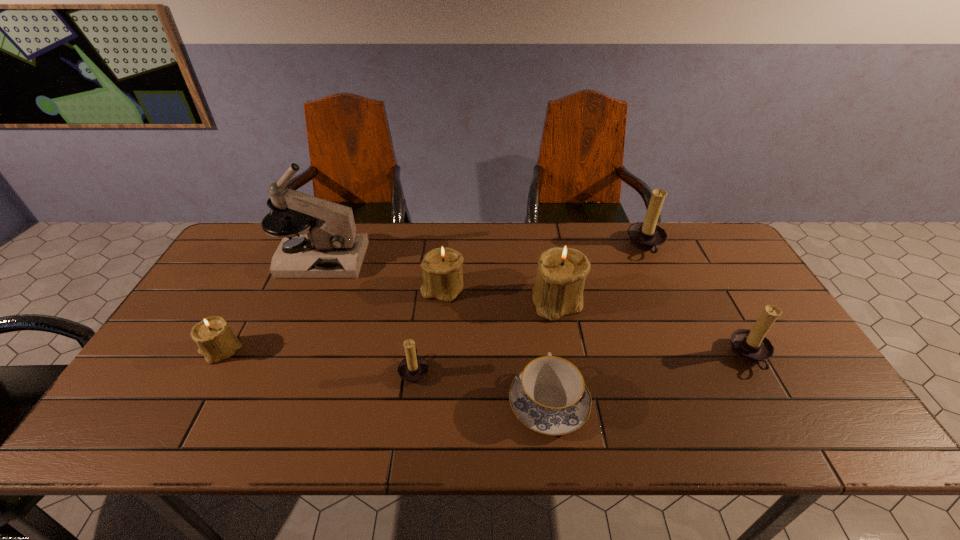
At what (x,y) coordinates should I click in order to perform the action: click on the smallest brown candle holder. Please return your answer as a coordinate pair (x, y). Looking at the image, I should click on (413, 369).

At what (x,y) coordinates should I click in order to perform the action: click on blue chinaware. Please return your answer as a coordinate pair (x, y). Looking at the image, I should click on (549, 396).

At what (x,y) coordinates should I click in order to perform the action: click on the shortest object. Please return your answer as a coordinate pair (x, y). The width and height of the screenshot is (960, 540). Looking at the image, I should click on (549, 396).

Where is `vacant space situated at the eyepiece of the tallest object`? The width and height of the screenshot is (960, 540). vacant space situated at the eyepiece of the tallest object is located at coordinates point(450,259).

Image resolution: width=960 pixels, height=540 pixels. I want to click on free location located on the wick of the fifth candle holder from left to right, so [x=564, y=246].

Where is `vacant region located on the wick of the fifth candle holder from left to right`? This screenshot has height=540, width=960. vacant region located on the wick of the fifth candle holder from left to right is located at coordinates (610, 246).

Locate an element on the screen. The width and height of the screenshot is (960, 540). free space located 0.370m on the wick of the fifth candle holder from left to right is located at coordinates (516, 246).

Locate an element on the screen. Image resolution: width=960 pixels, height=540 pixels. vacant space located 0.230m on the back of the rightmost beige candle_holder is located at coordinates (546, 236).

At what (x,y) coordinates should I click in order to perform the action: click on free space located on the left of the second beige candle_holder from left to right. Please return your answer as a coordinate pair (x, y). The height and width of the screenshot is (540, 960). Looking at the image, I should click on [364, 288].

I want to click on free space located 0.090m on the wick of the second smallest brown candle holder, so click(x=696, y=356).